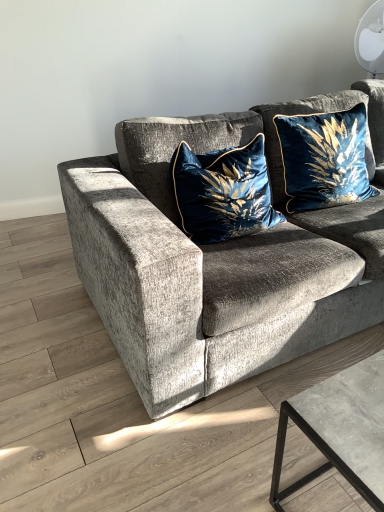
Question: Relative to velvet blue pillow at center, acting as the 2th pillow starting from the right, is velvet blue pillow at upper right, the first pillow from the right, in front or behind?

Choices:
 (A) behind
 (B) front

Answer: (A)

Question: Does point (327, 156) appear closer or farther from the camera than point (236, 174)?

Choices:
 (A) closer
 (B) farther

Answer: (B)

Question: Which object is positioned farthest from the velvet gray couch at center?

Choices:
 (A) velvet blue pillow at center, acting as the 2th pillow starting from the right
 (B) velvet blue pillow at upper right, which ranks as the 2th pillow in left-to-right order

Answer: (B)

Question: Estimate the real-world distances between objects in this image. Which object is farther from the velvet blue pillow at upper right, the first pillow from the right?

Choices:
 (A) velvet gray couch at center
 (B) velvet blue pillow at center, acting as the 1th pillow starting from the left

Answer: (A)